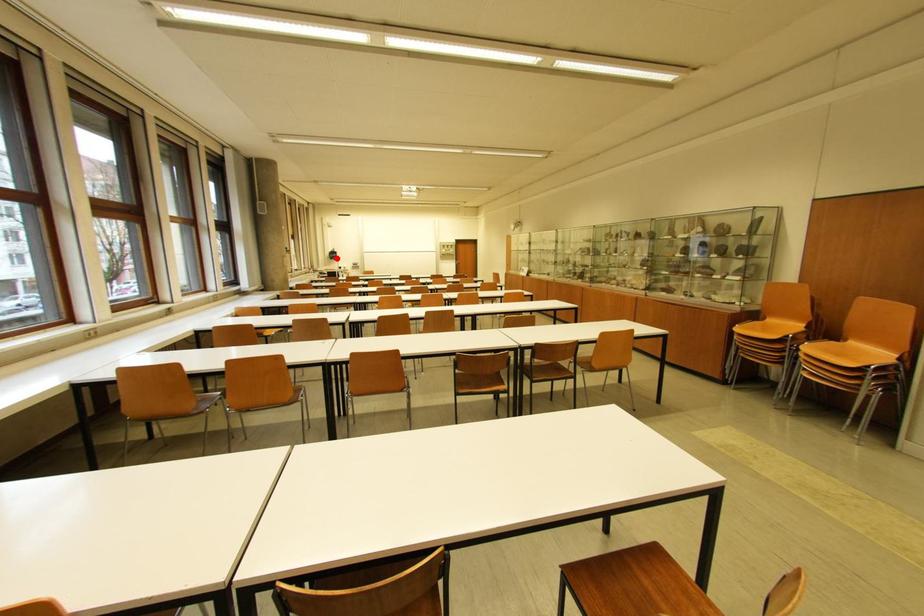
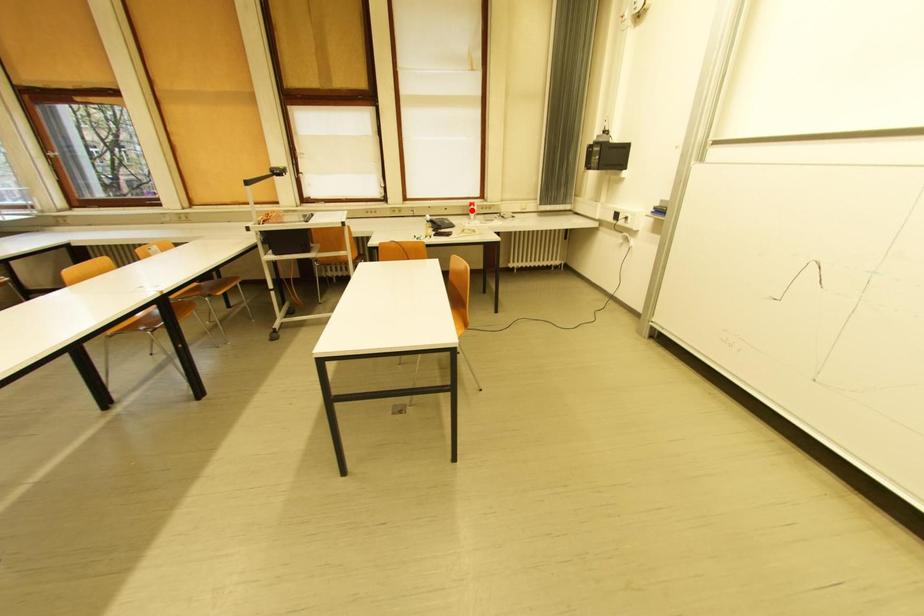
I am providing you with two images of the same scene from different viewpoints. A red point is marked on the first image and another point is marked on the second image. Are the points marked in image1 and image2 representing the same 3D position?

No